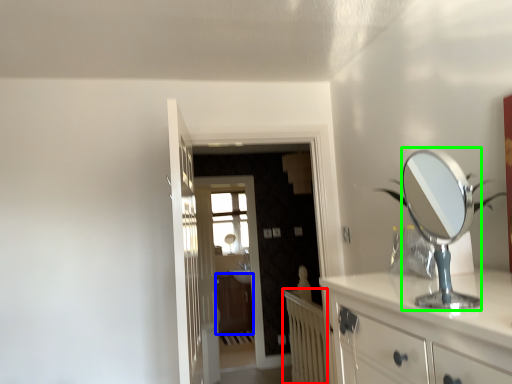
Question: Which object is the closest to the radiator (highlighted by a red box)? Choose among these: cabinetry (highlighted by a blue box) or mirror (highlighted by a green box).

Choices:
 (A) cabinetry
 (B) mirror

Answer: (A)